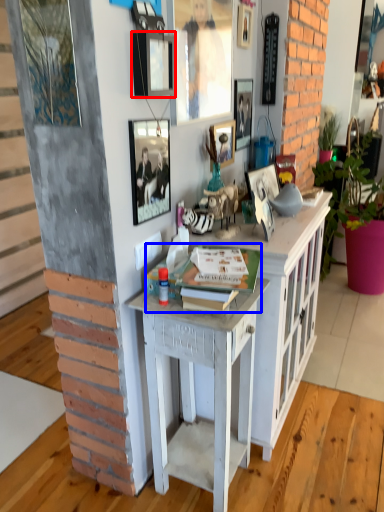
Question: Which point is closer to the camera, picture frame (highlighted by a red box) or book (highlighted by a blue box)?

Choices:
 (A) picture frame
 (B) book

Answer: (A)